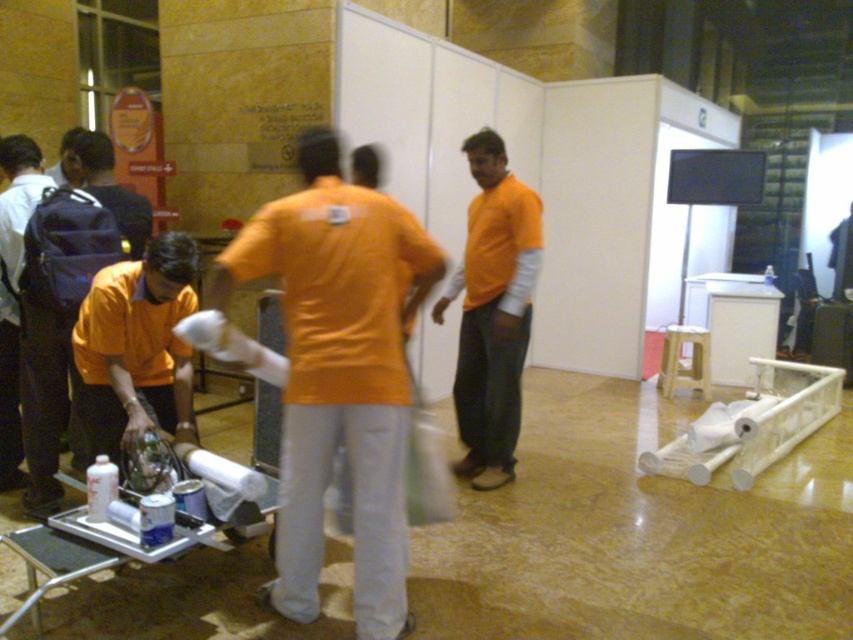
Question: Does matte black backpack at left appear on the right side of matte orange shirt at upper left?

Choices:
 (A) yes
 (B) no

Answer: (A)

Question: Is the position of orange matte shirt at center more distant than that of matte black backpack at left?

Choices:
 (A) yes
 (B) no

Answer: (B)

Question: Among these objects, which one is farthest from the camera?

Choices:
 (A) orange matte shirt at center
 (B) matte orange shirt at upper left

Answer: (B)

Question: Estimate the real-world distances between objects in this image. Which object is closer to the matte orange shirt at left?

Choices:
 (A) matte black backpack at left
 (B) orange cotton shirt at center
 (C) orange matte shirt at center
 (D) matte orange shirt at upper left

Answer: (C)

Question: Which of the following is the closest to the observer?

Choices:
 (A) matte orange shirt at left
 (B) matte orange shirt at upper left
 (C) matte black backpack at left

Answer: (A)

Question: Is orange cotton shirt at center further to camera compared to matte orange shirt at left?

Choices:
 (A) yes
 (B) no

Answer: (A)